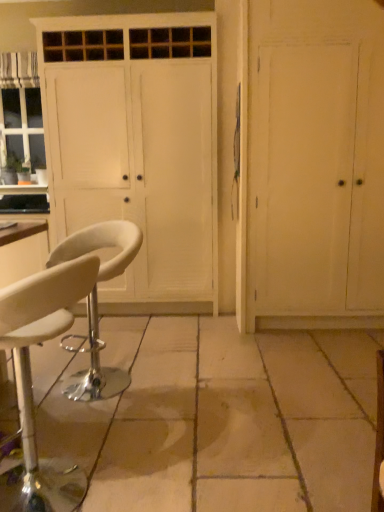
Where is `free space behind white leather stool at lower left, the first chair when ordered from back to front`? free space behind white leather stool at lower left, the first chair when ordered from back to front is located at coordinates (138, 347).